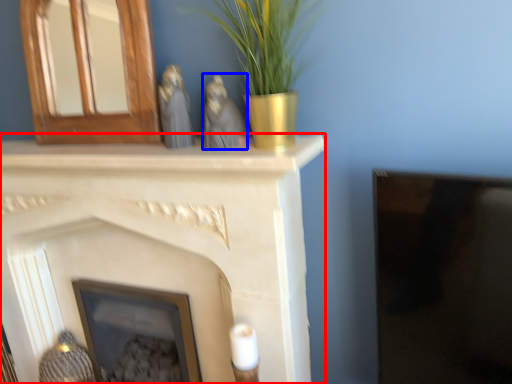
Question: Which of the following is the farthest to the observer, fireplace (highlighted by a red box) or animal (highlighted by a blue box)?

Choices:
 (A) fireplace
 (B) animal

Answer: (A)